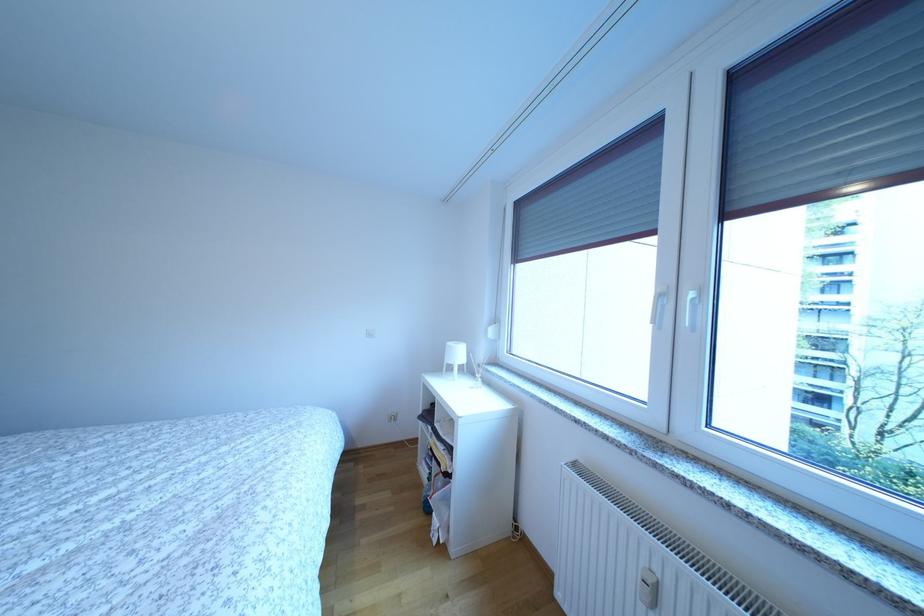
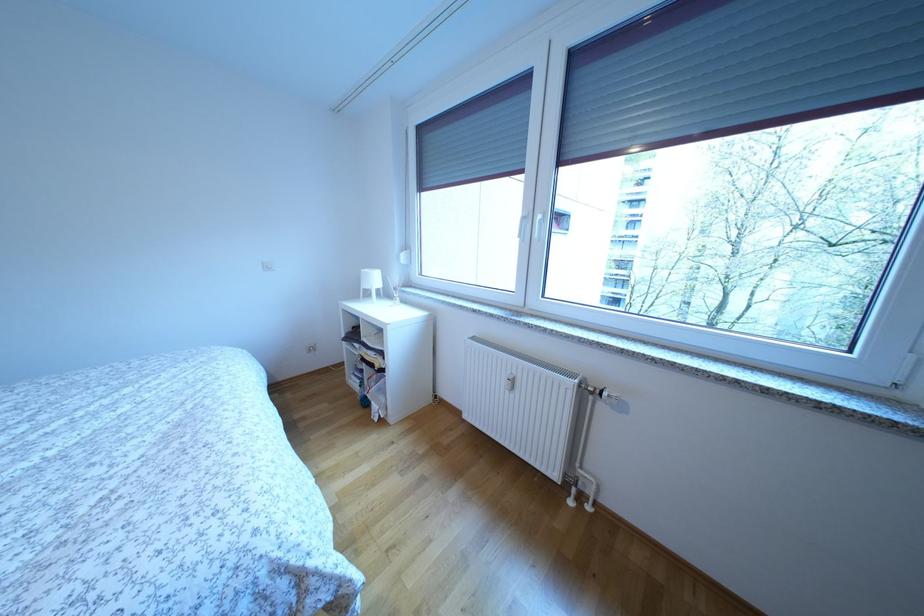
The point at (675,302) is marked in the first image. Where is the corresponding point in the second image?

(535, 224)